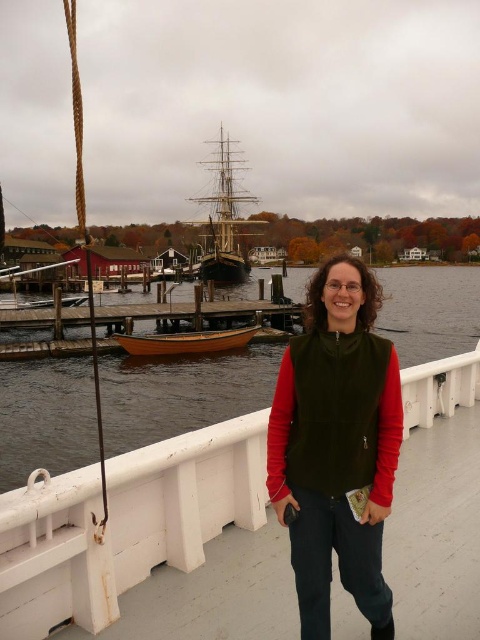
Question: Does green fleece vest at center have a lesser width compared to wooden boat at center?

Choices:
 (A) yes
 (B) no

Answer: (B)

Question: Which object is the farthest from the wooden ship at center?

Choices:
 (A) clear water at lower center
 (B) white wooden deck at center
 (C) green fleece vest at center
 (D) wooden boat at center

Answer: (B)

Question: Among these objects, which one is farthest from the camera?

Choices:
 (A) wooden ship at center
 (B) wooden boat at center
 (C) clear water at lower center

Answer: (A)

Question: Can you confirm if green fleece vest at center is positioned above wooden ship at center?

Choices:
 (A) yes
 (B) no

Answer: (B)

Question: Considering the relative positions of wooden ship at center and wooden boat at center in the image provided, where is wooden ship at center located with respect to wooden boat at center?

Choices:
 (A) right
 (B) left

Answer: (B)

Question: Which point is closer to the camera taking this photo?

Choices:
 (A) (233, 196)
 (B) (287, 412)
 (C) (450, 324)

Answer: (B)